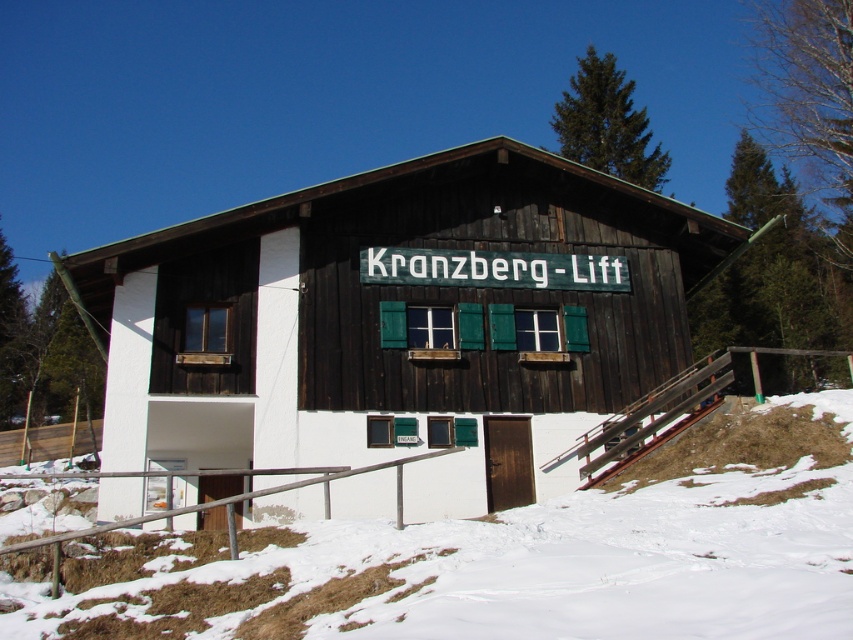
Identify the location of wooden cabin at center. (402, 321).

From the picture: Is wooden cabin at center to the right of metal/wooden handrail at lower center from the viewer's perspective?

Yes, wooden cabin at center is to the right of metal/wooden handrail at lower center.

Is point (131, 401) positioned behind point (427, 454)?

No, (131, 401) is in front of (427, 454).

Locate an element on the screen. Image resolution: width=853 pixels, height=640 pixels. wooden cabin at center is located at coordinates (402, 321).

Who is higher up, wooden cabin at center or white powdery snow at lower left?

wooden cabin at center is higher up.

Can you confirm if wooden cabin at center is bigger than white powdery snow at lower left?

Yes, wooden cabin at center is bigger than white powdery snow at lower left.

Is point (263, 513) positioned after point (173, 618)?

That is True.

The height and width of the screenshot is (640, 853). Identify the location of wooden cabin at center. (402, 321).

Does white powdery snow at lower left have a lesser width compared to metal/wooden handrail at lower center?

In fact, white powdery snow at lower left might be wider than metal/wooden handrail at lower center.

Is point (705, 588) positioned after point (397, 499)?

No.

The image size is (853, 640). Identify the location of white powdery snow at lower left. (508, 557).